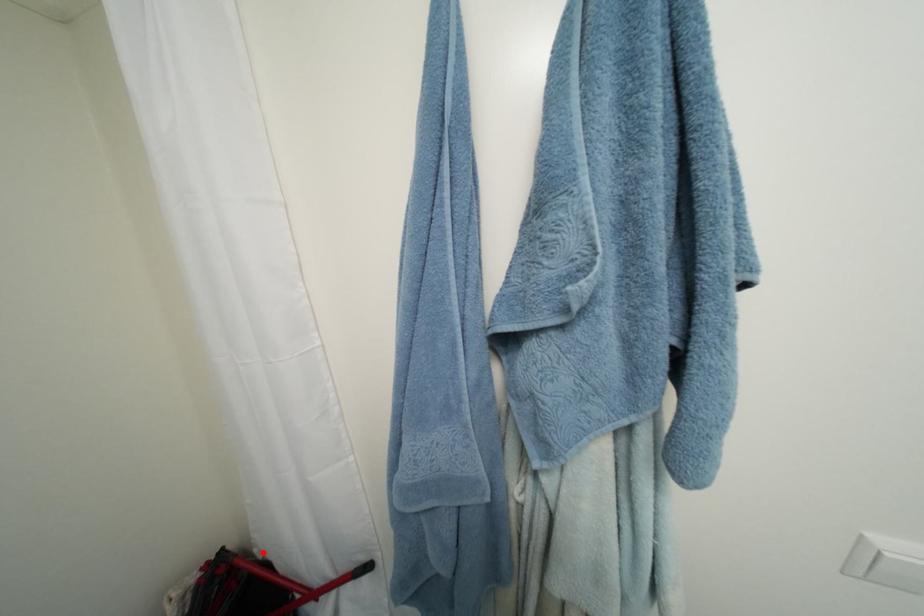
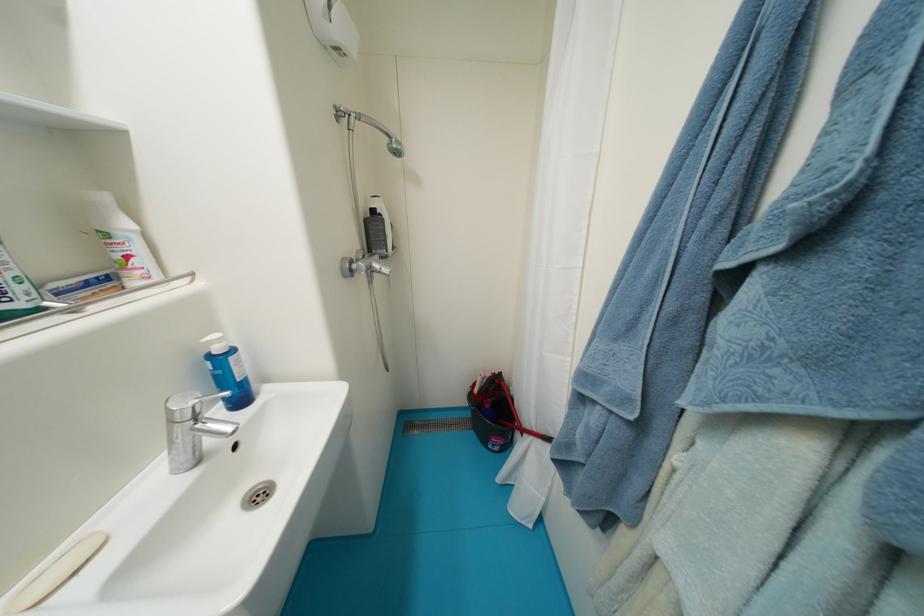
Question: I am providing you with two images of the same scene from different viewpoints. Image1 has a red point marked. In image2, the corresponding 3D location appears at what relative position? Reply with the corresponding letter.

Choices:
 (A) Closer
 (B) Farther

Answer: (B)